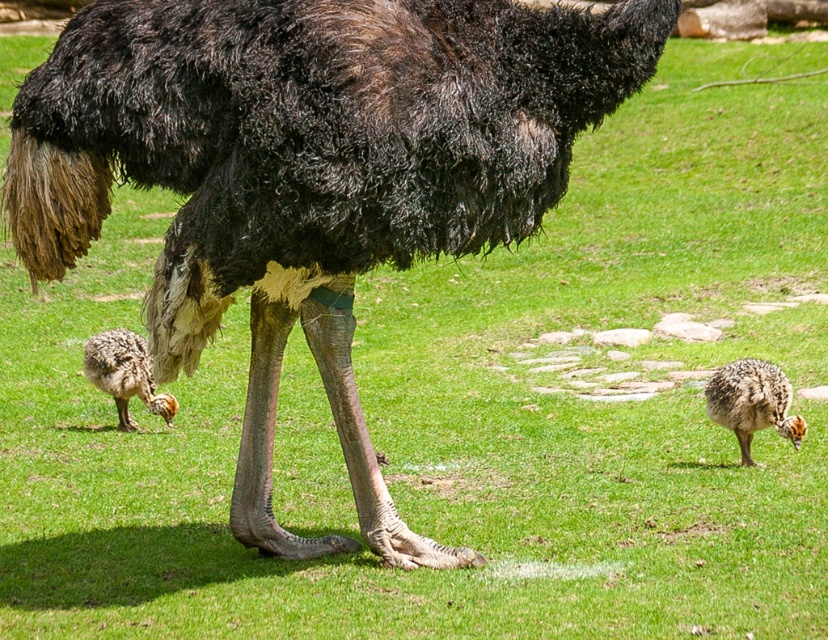
The height and width of the screenshot is (640, 828). Describe the element at coordinates (310, 177) in the screenshot. I see `black feathered ostrich at center` at that location.

Does black feathered ostrich at center appear on the right side of spotted feathered chick at lower right?

Incorrect, black feathered ostrich at center is not on the right side of spotted feathered chick at lower right.

What do you see at coordinates (310, 177) in the screenshot?
I see `black feathered ostrich at center` at bounding box center [310, 177].

Where is `black feathered ostrich at center`? This screenshot has height=640, width=828. black feathered ostrich at center is located at coordinates click(x=310, y=177).

In the scene shown: Does spotted feathered chick at lower right have a lesser width compared to speckled feathered chick at lower left?

Indeed, spotted feathered chick at lower right has a lesser width compared to speckled feathered chick at lower left.

Can you confirm if spotted feathered chick at lower right is positioned below speckled feathered chick at lower left?

Correct, spotted feathered chick at lower right is located below speckled feathered chick at lower left.

What do you see at coordinates (752, 403) in the screenshot?
I see `spotted feathered chick at lower right` at bounding box center [752, 403].

This screenshot has width=828, height=640. What are the coordinates of `spotted feathered chick at lower right` in the screenshot? It's located at (752, 403).

Who is shorter, black feathered ostrich at center or speckled feathered chick at lower left?

With less height is speckled feathered chick at lower left.

Is black feathered ostrich at center positioned in front of speckled feathered chick at lower left?

Yes, black feathered ostrich at center is in front of speckled feathered chick at lower left.

Consider the image. Who is more forward, (328, 356) or (121, 378)?

Point (328, 356)

This screenshot has height=640, width=828. Find the location of `black feathered ostrich at center`. black feathered ostrich at center is located at coordinates [310, 177].